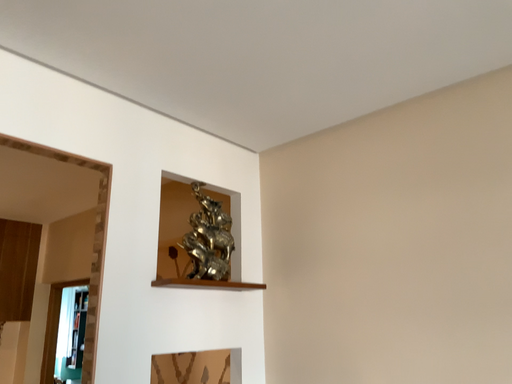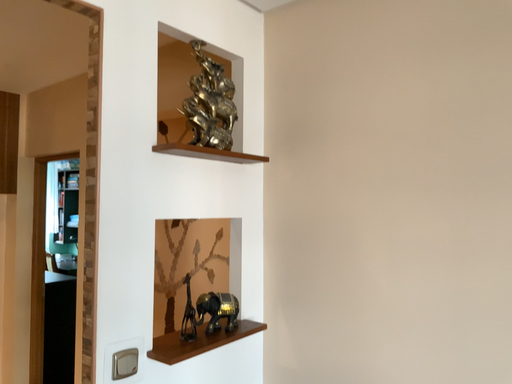
Question: How did the camera likely rotate when shooting the video?

Choices:
 (A) rotated downward
 (B) rotated upward

Answer: (A)